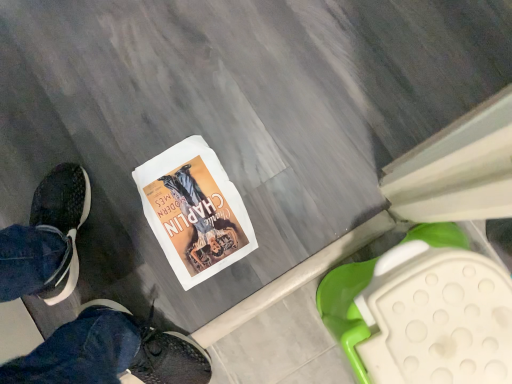
Find the location of a particular element. empty space that is to the right of white paper comic book at center is located at coordinates (267, 160).